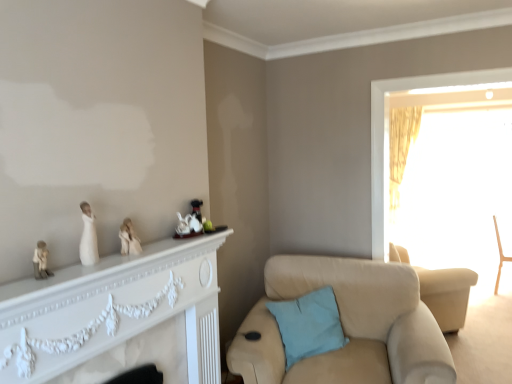
Identify the location of vacant space that is in between white porcelain figurine at left, which is the 2th person from right to left, and white porcelain figurine at center, marked as the 1th person in a right-to-left arrangement. (114, 259).